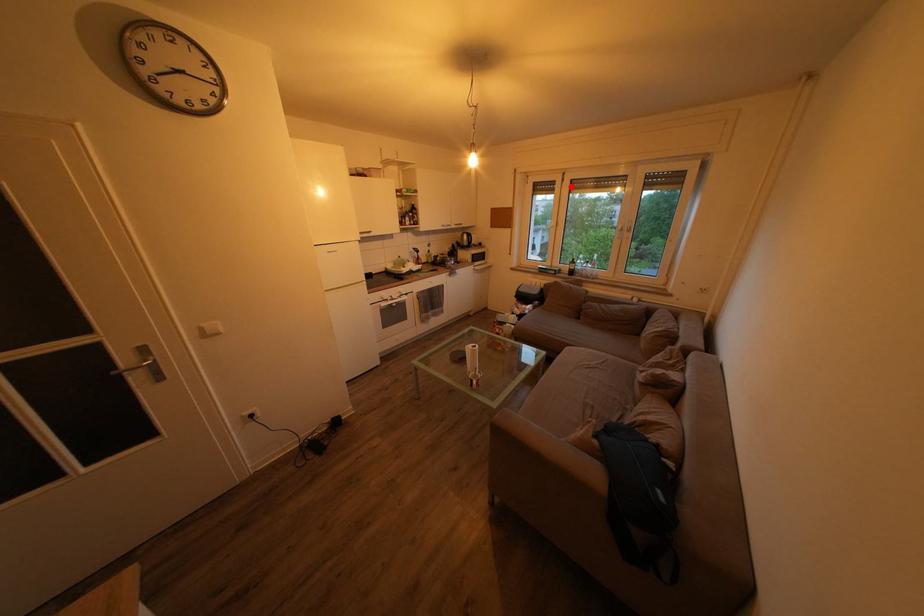
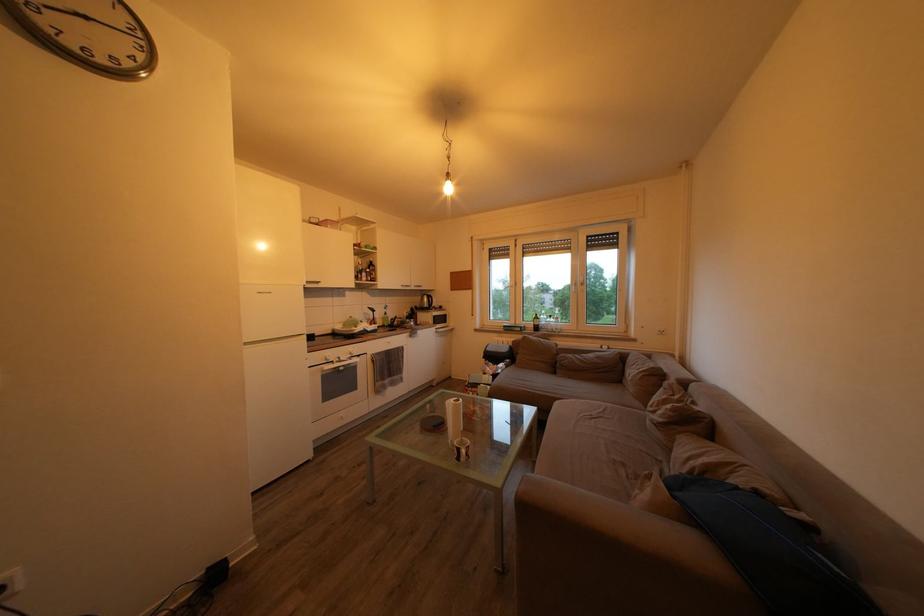
The point at the highlighted location is marked in the first image. Where is the corresponding point in the second image?

(524, 252)